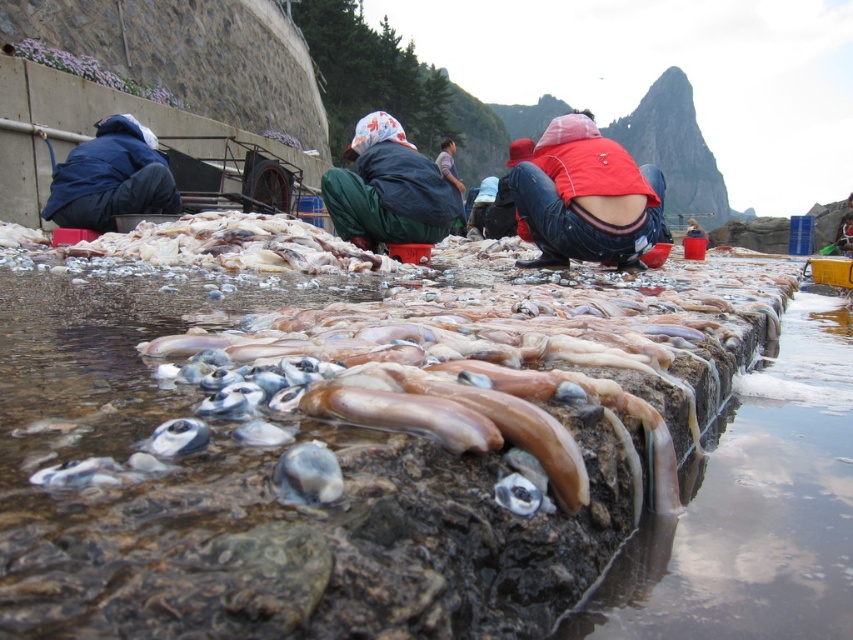
Which is more to the left, red matte jacket at center or matte black jacket at center?

Positioned to the left is matte black jacket at center.

Does red matte jacket at center have a lesser height compared to matte black jacket at center?

Indeed, red matte jacket at center has a lesser height compared to matte black jacket at center.

Which is behind, point (635, 218) or point (450, 173)?

Point (450, 173)

The image size is (853, 640). Identify the location of red matte jacket at center. (585, 196).

Is dark blue down jacket at left wider than translucent rubber squid at center?

Correct, the width of dark blue down jacket at left exceeds that of translucent rubber squid at center.

Does point (107, 173) come farther from viewer compared to point (428, 426)?

Yes, it is.

Is point (137, 204) closer to viewer compared to point (409, 420)?

No, it is not.

Where is `dark blue down jacket at left`? dark blue down jacket at left is located at coordinates tap(111, 177).

Is translucent wet rock at center positioned at the back of green fabric pants at center?

No.

Does translucent wet rock at center have a greater height compared to green fabric pants at center?

In fact, translucent wet rock at center may be shorter than green fabric pants at center.

Is point (190, 580) more distant than point (445, 224)?

No, it is not.

Image resolution: width=853 pixels, height=640 pixels. I want to click on translucent wet rock at center, so click(347, 451).